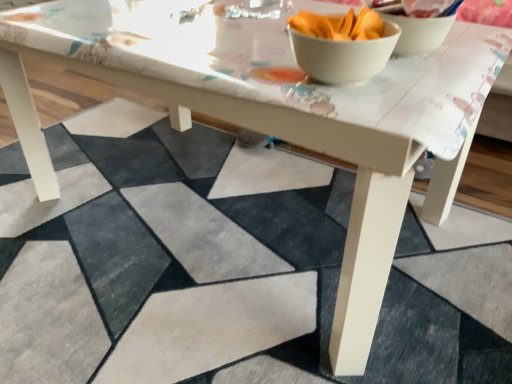
The height and width of the screenshot is (384, 512). I want to click on white matte bowl at upper center, so click(342, 45).

The height and width of the screenshot is (384, 512). Describe the element at coordinates (342, 45) in the screenshot. I see `white matte bowl at upper center` at that location.

The height and width of the screenshot is (384, 512). Identify the location of white matte bowl at upper center. (342, 45).